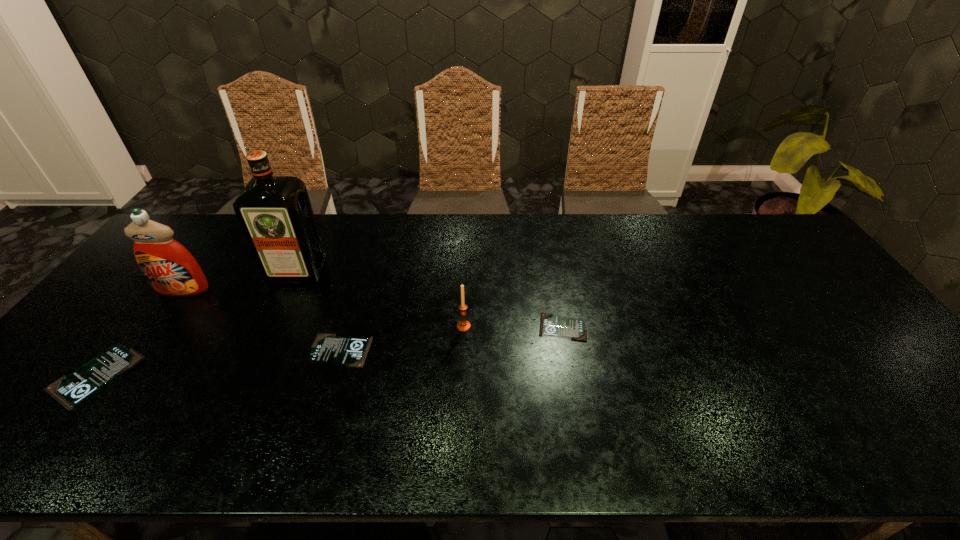
Where is `vacant area situated 0.310m on the back of the leftmost identity card`? vacant area situated 0.310m on the back of the leftmost identity card is located at coordinates (179, 267).

Locate an element on the screen. vacant position located on the back of the second identity card from right to left is located at coordinates (349, 320).

Where is `free space located 0.400m on the right of the rightmost object`? The height and width of the screenshot is (540, 960). free space located 0.400m on the right of the rightmost object is located at coordinates (733, 327).

The image size is (960, 540). I want to click on vacant space positioned 0.140m on the left of the candle_holder, so click(x=405, y=326).

The width and height of the screenshot is (960, 540). In order to click on vacant space located on the front surface of the second tallest object in this screenshot , I will do `click(168, 310)`.

Where is `vacant position located on the front label of the third object from left to right`? This screenshot has height=540, width=960. vacant position located on the front label of the third object from left to right is located at coordinates (247, 381).

At what (x,y) coordinates should I click in order to perform the action: click on object that is at the near edge. Please return your answer as a coordinate pair (x, y). The width and height of the screenshot is (960, 540). Looking at the image, I should click on (70, 390).

Find the location of a particular element. The width and height of the screenshot is (960, 540). identity card situated at the left edge is located at coordinates (70, 390).

At what (x,y) coordinates should I click in order to perform the action: click on detergent present at the left edge. Please return your answer as a coordinate pair (x, y). Image resolution: width=960 pixels, height=540 pixels. Looking at the image, I should click on (169, 267).

Find the location of `object that is at the near left corner`. object that is at the near left corner is located at coordinates (70, 390).